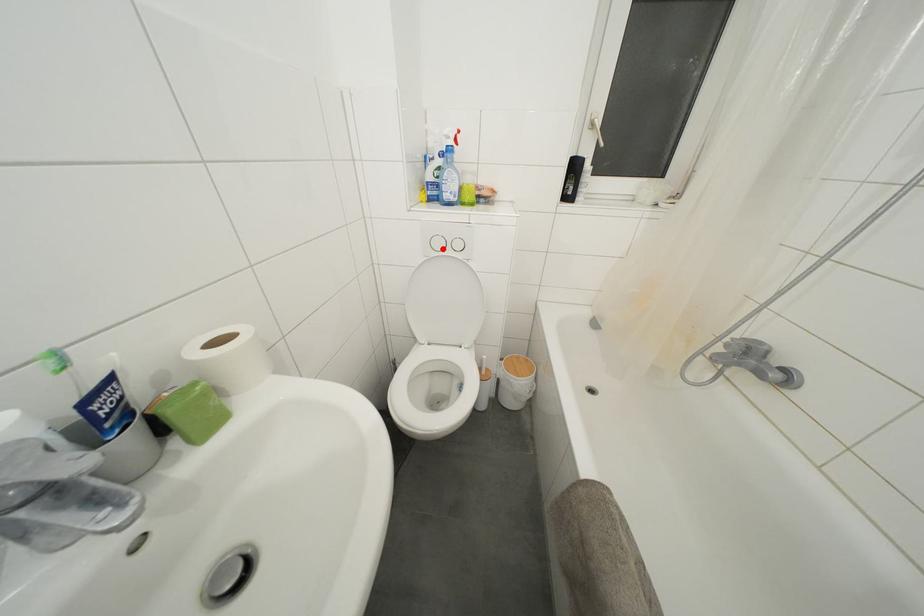
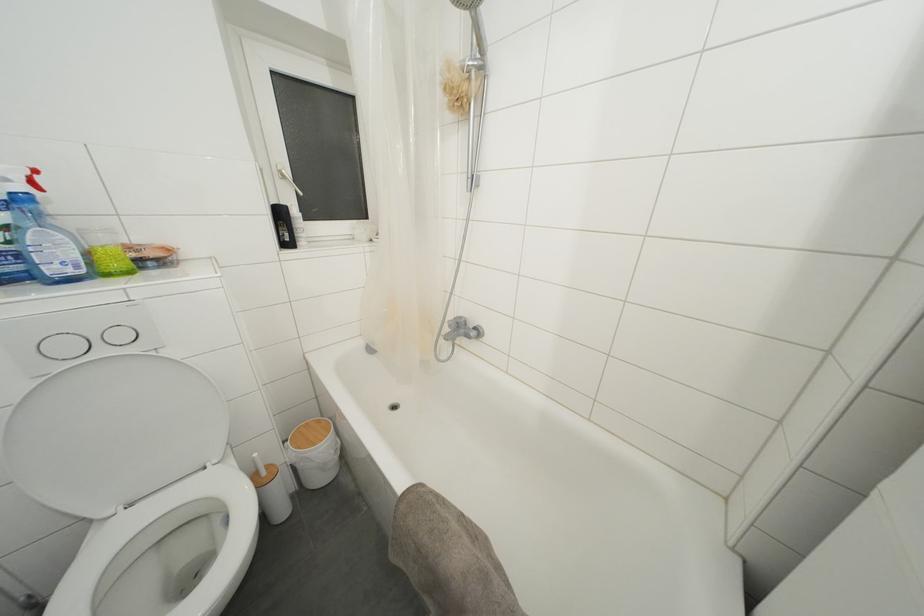
Question: I am providing you with two images of the same scene from different viewpoints. Image1 has a red point marked. In image2, the corresponding 3D location appears at what relative position? Reply with the corresponding letter.

Choices:
 (A) Closer
 (B) Farther

Answer: (B)